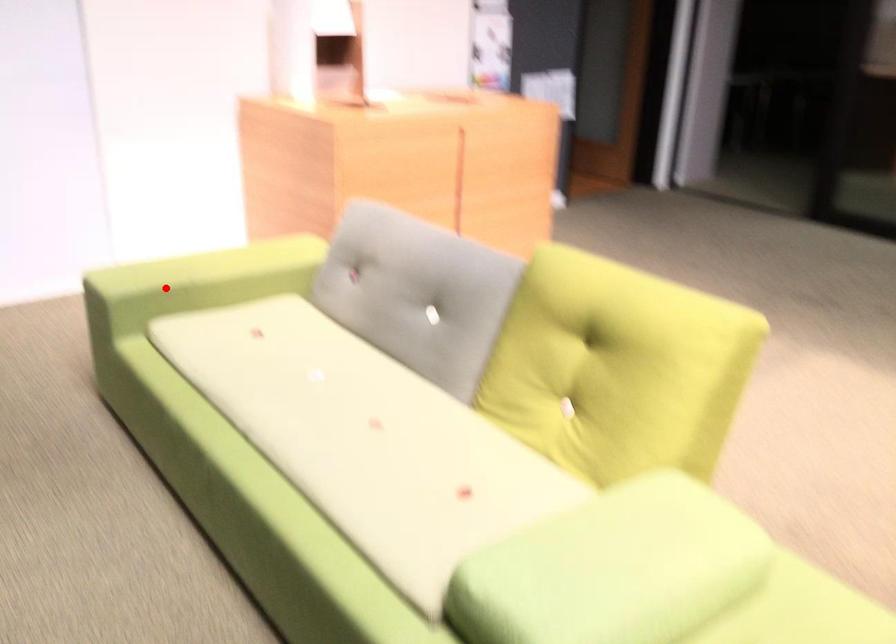
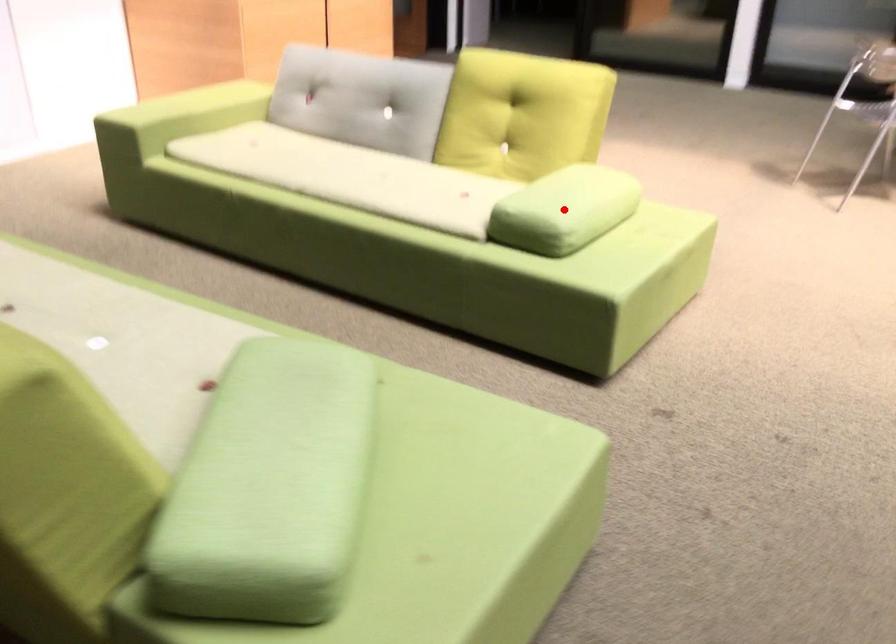
I am providing you with two images of the same scene from different viewpoints. A red point is marked on the first image and another point is marked on the second image. Do the highlighted points in image1 and image2 indicate the same real-world spot?

No